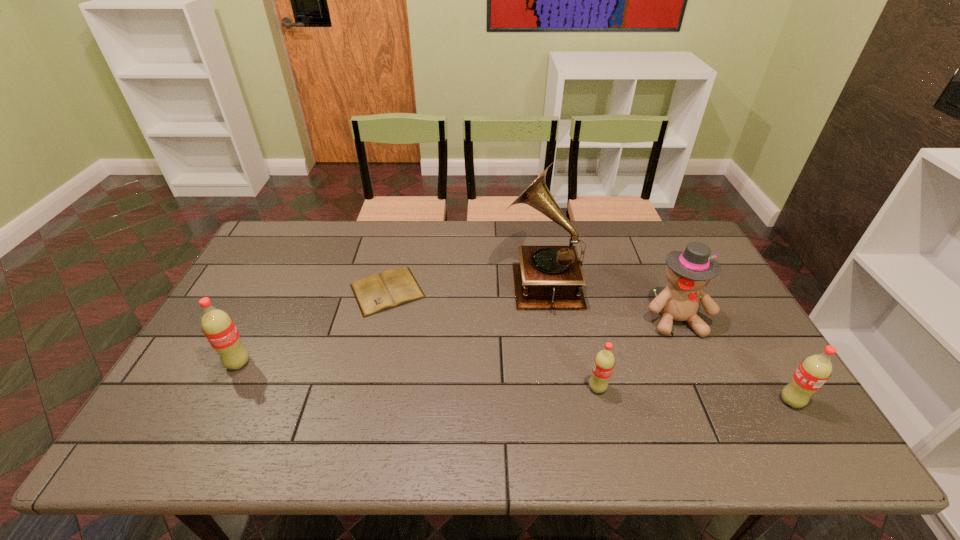
Image resolution: width=960 pixels, height=540 pixels. Find the location of `soda that is at the right edge`. soda that is at the right edge is located at coordinates (815, 370).

Find the location of `rag_doll at the right edge`. rag_doll at the right edge is located at coordinates (688, 272).

Find the location of `object that is positioned at the near right corner`. object that is positioned at the near right corner is located at coordinates tap(815, 370).

Locate an element on the screen. free region at the far edge of the desktop is located at coordinates [520, 244].

Locate an element on the screen. vacant region at the near edge is located at coordinates (470, 387).

Find the location of a particular element. This screenshot has height=540, width=960. free space at the left edge is located at coordinates [209, 372].

Locate an element on the screen. This screenshot has width=960, height=540. vacant region at the right edge of the desktop is located at coordinates (712, 364).

You are a GUI agent. You are given a task and a screenshot of the screen. Output one action in this format:
    pyautogui.click(x=<x>, y=<y>)
    Task: Click on the free space at the near left corner of the desktop
    Image resolution: width=960 pixels, height=540 pixels.
    Given the screenshot: What is the action you would take?
    pyautogui.click(x=198, y=398)

Identify the location of free area in between the fifth object from left to right and the leftmost soda. This screenshot has height=540, width=960. tap(457, 341).

What are the coordinates of `vacant area that lies between the book and the record player` in the screenshot? It's located at (464, 286).